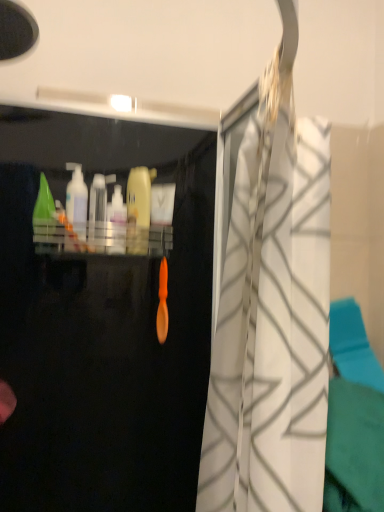
Question: Is green plastic cone at upper left, which is counted as the fourth cleaning product, starting from the right, thinner than transparent plastic bottle at center?

Choices:
 (A) no
 (B) yes

Answer: (A)

Question: Can you confirm if green plastic cone at upper left, which is counted as the fourth cleaning product, starting from the right, is bigger than transparent plastic bottle at center?

Choices:
 (A) yes
 (B) no

Answer: (A)

Question: Can transparent plastic bottle at center be found inside green plastic cone at upper left, which ranks as the first cleaning product in left-to-right order?

Choices:
 (A) no
 (B) yes

Answer: (A)

Question: From a real-world perspective, is green plastic cone at upper left, which is counted as the fourth cleaning product, starting from the right, below transparent plastic bottle at center?

Choices:
 (A) no
 (B) yes

Answer: (A)

Question: Is green plastic cone at upper left, which ranks as the first cleaning product in left-to-right order, at the right side of transparent plastic bottle at center?

Choices:
 (A) no
 (B) yes

Answer: (A)

Question: From a real-world perspective, is transparent plastic bottle at center physically located above or below green plastic cone at upper left, which is counted as the fourth cleaning product, starting from the right?

Choices:
 (A) above
 (B) below

Answer: (B)

Question: Is transparent plastic bottle at center in front of or behind green plastic cone at upper left, which ranks as the first cleaning product in left-to-right order, in the image?

Choices:
 (A) front
 (B) behind

Answer: (B)

Question: Considering the relative positions of transparent plastic bottle at center and green plastic cone at upper left, which ranks as the first cleaning product in left-to-right order, in the image provided, is transparent plastic bottle at center to the left or to the right of green plastic cone at upper left, which ranks as the first cleaning product in left-to-right order,?

Choices:
 (A) right
 (B) left

Answer: (A)

Question: Based on their sizes in the image, would you say transparent plastic bottle at center is bigger or smaller than green plastic cone at upper left, which is counted as the fourth cleaning product, starting from the right?

Choices:
 (A) big
 (B) small

Answer: (B)

Question: From the image's perspective, is translucent plastic bottle at center, the second cleaning product viewed from the right, above or below yellow matte bottle at center, which is the first cleaning product in right-to-left order?

Choices:
 (A) below
 (B) above

Answer: (A)

Question: Is translucent plastic bottle at center, the second cleaning product viewed from the right, inside the boundaries of yellow matte bottle at center, arranged as the 4th cleaning product when viewed from the left, or outside?

Choices:
 (A) outside
 (B) inside

Answer: (A)

Question: Is translucent plastic bottle at center, acting as the third cleaning product starting from the left, in front of or behind yellow matte bottle at center, arranged as the 4th cleaning product when viewed from the left, in the image?

Choices:
 (A) front
 (B) behind

Answer: (A)

Question: Is translucent plastic bottle at center, the second cleaning product viewed from the right, to the left or to the right of yellow matte bottle at center, arranged as the 4th cleaning product when viewed from the left, in the image?

Choices:
 (A) left
 (B) right

Answer: (A)

Question: Considering their positions, is translucent plastic bottle at center, the second cleaning product viewed from the right, located in front of or behind green plastic cone at upper left, which ranks as the first cleaning product in left-to-right order?

Choices:
 (A) front
 (B) behind

Answer: (B)

Question: Is translucent plastic bottle at center, acting as the third cleaning product starting from the left, inside the boundaries of green plastic cone at upper left, which is counted as the fourth cleaning product, starting from the right, or outside?

Choices:
 (A) inside
 (B) outside

Answer: (B)